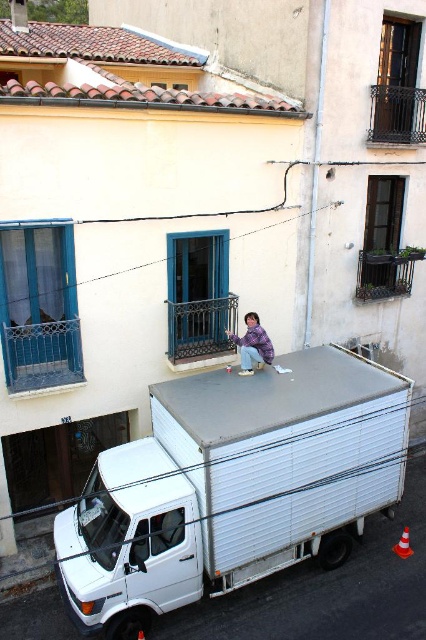
From the picture: You are a delivery person who needs to load a package onto the white matte van at lower left. The package is 1.2 meters tall. Can you safely place it on top of the purple fabric at center without exceeding the height limit?

The white matte van at lower left is taller than the purple fabric at center. Since the package is 1.2 meters tall, it should be placed on the van to ensure it doesn

You are standing on the sidewalk and see the white matte truck at center. If you want to walk to the truck, how many steps would you need to take if each step is about 2.5 feet?

The distance between you and the white matte truck at center is 24.57 feet. Dividing this by 2.5 feet per step gives approximately 9.83 steps. Since you can only take whole steps, you would need to take 10 steps to reach the truck.

You are standing at the point with coordinates (233, 486). Based on the scene, where are you located?

The point (233, 486) is on the white matte truck at center.